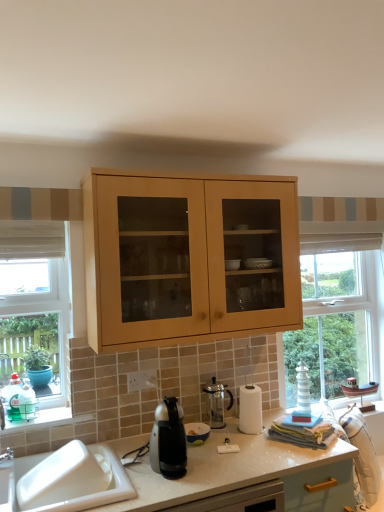
In order to click on empty space that is to the right of matte black coffee maker at center, the second appliance viewed from the back in this screenshot , I will do `click(221, 440)`.